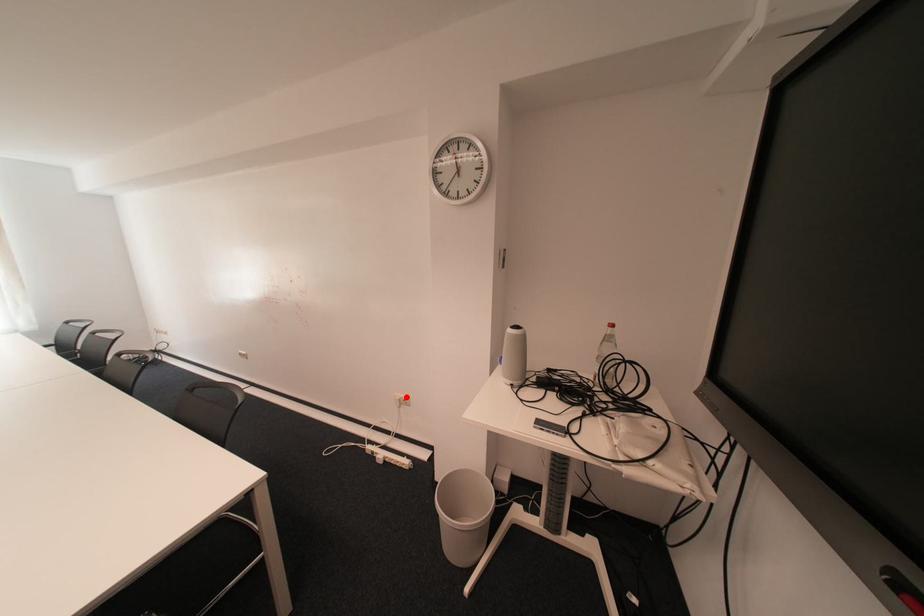
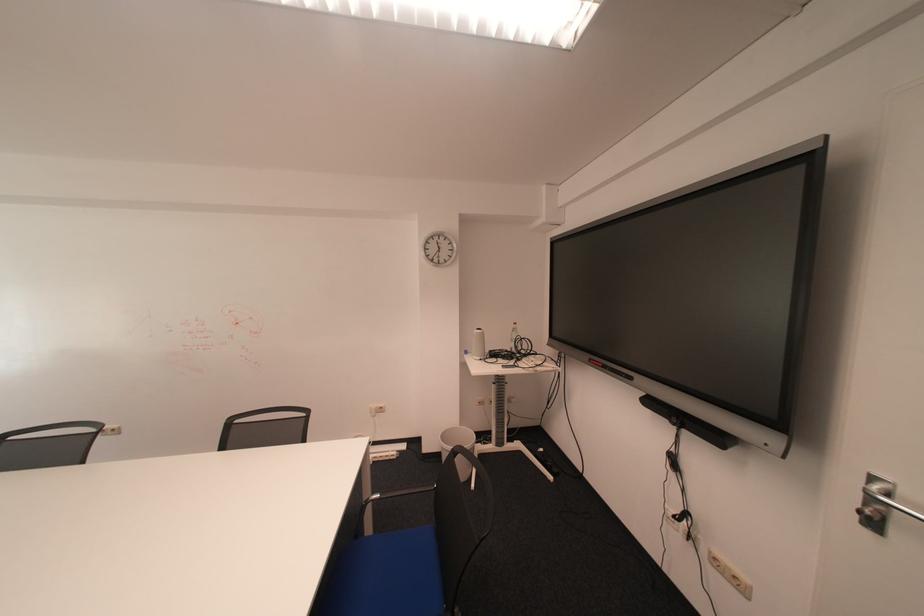
The point at the highlighted location is marked in the first image. Where is the corresponding point in the second image?

(382, 408)